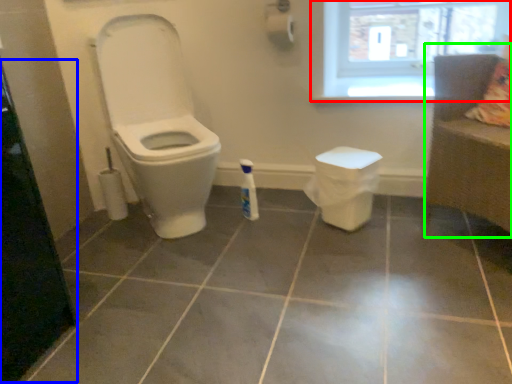
Question: Which object is the farthest from window (highlighted by a red box)? Choose among these: screen door (highlighted by a blue box) or couch (highlighted by a green box).

Choices:
 (A) screen door
 (B) couch

Answer: (A)